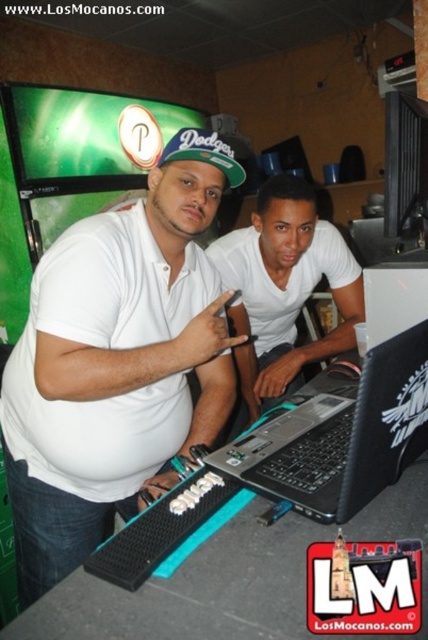
You are trying to locate the black plastic laptop at center in the image. Which object from the list below is exactly at the coordinates point (341, 436)? Choose from the options below. A. The person on the left B. The person on the right C. The green screen with a logo D. The black plastic laptop at center

The point (341, 436) is on the black plastic laptop at center, so the correct answer is D. The black plastic laptop at center.

You are organizing a small event and need to place a white matte laptop at center and a green fabric baseball cap at center on a shelf that can only hold items up to 12 inches in width. Given their sizes, can both items fit side by side on the shelf?

The white matte laptop at center is wider than the green fabric baseball cap at center. However, without knowing the exact width of the laptop, it is impossible to determine if both items can fit side by side on the 12 inch shelf.

You are trying to decide which object to move first so that both the white matte laptop at center and the green fabric baseball cap at center can fit on a shelf that can only hold items up to the size of the larger one. Which object should you move first?

The white matte laptop at center is bigger than the green fabric baseball cap at center, so you should move the green fabric baseball cap at center first to make space for the larger item.